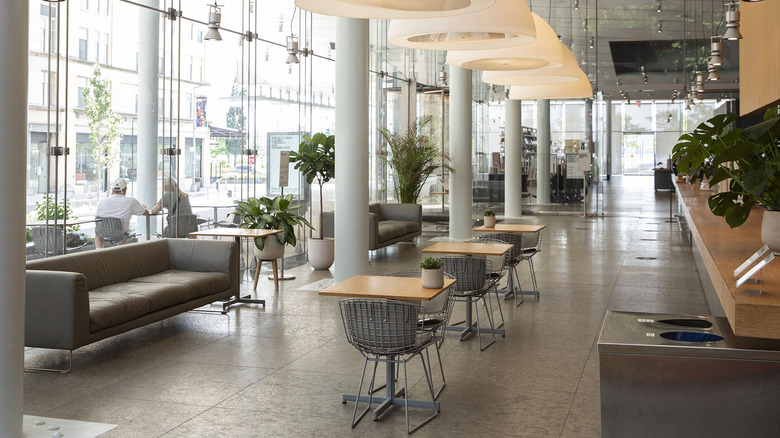
This screenshot has width=780, height=438. I want to click on indoor plants, so click(x=284, y=212), click(x=325, y=161), click(x=434, y=156), click(x=679, y=153), click(x=771, y=186).